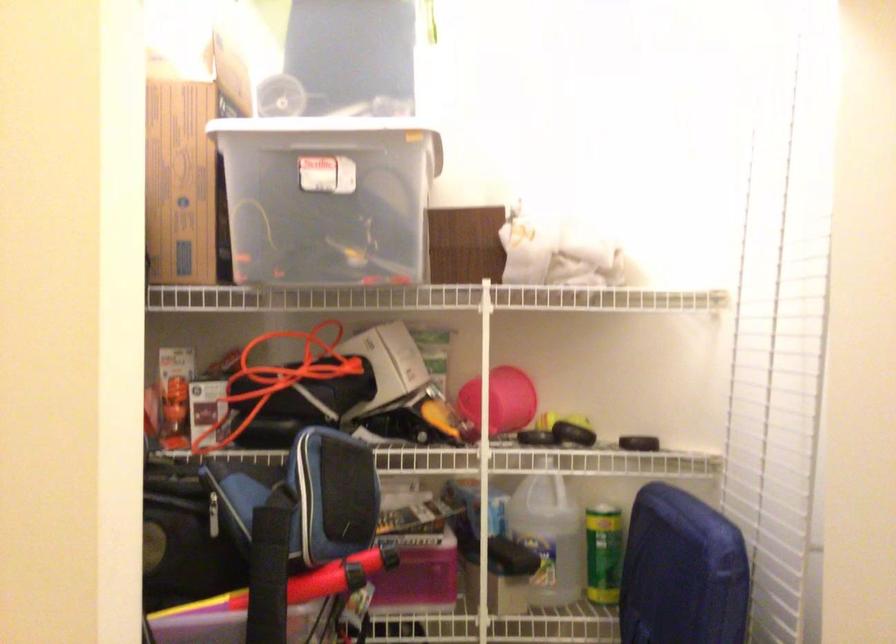
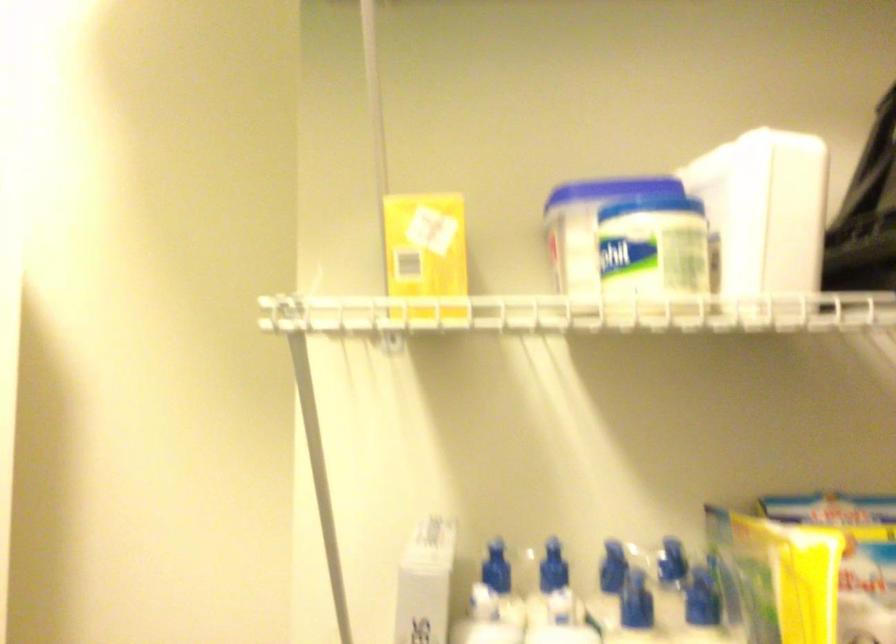
Which direction would the cameraman need to move to produce the second image?

The movement direction of the cameraman is right, backward.